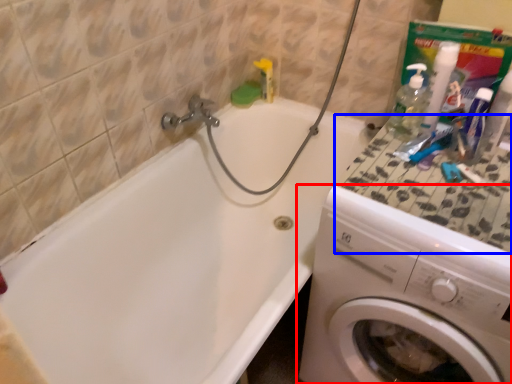
Question: Which of the following is the farthest to the observer, washing machine (highlighted by a red box) or counter top (highlighted by a blue box)?

Choices:
 (A) washing machine
 (B) counter top

Answer: (B)